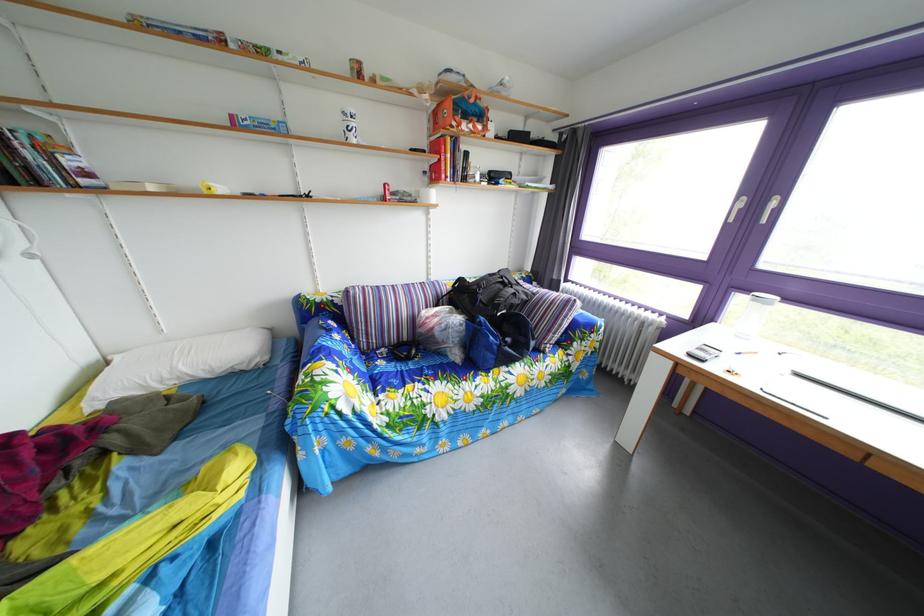
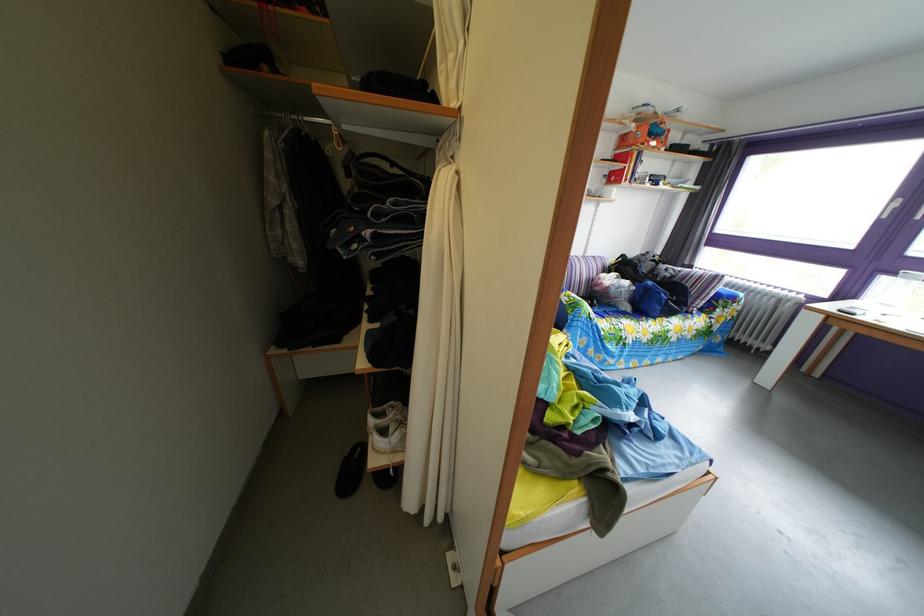
The point at (x=439, y=283) is marked in the first image. Where is the corresponding point in the second image?

(596, 261)